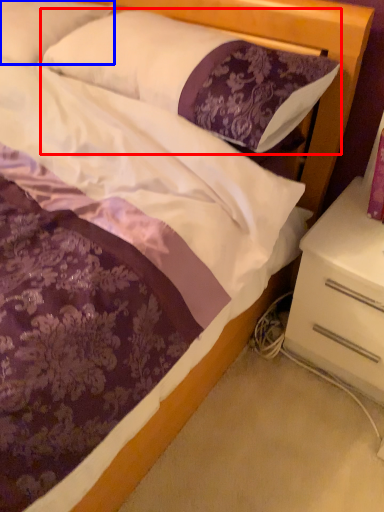
Question: Which of the following is the closest to the observer, pillow (highlighted by a red box) or pillow (highlighted by a blue box)?

Choices:
 (A) pillow
 (B) pillow

Answer: (A)